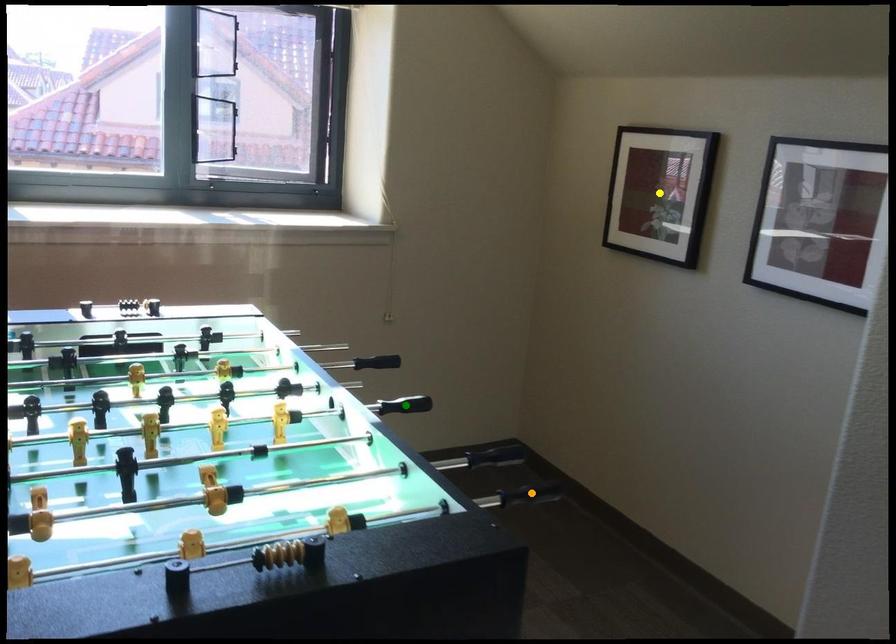
Order these from farthest to nearest:
orange point | green point | yellow point

green point → yellow point → orange point